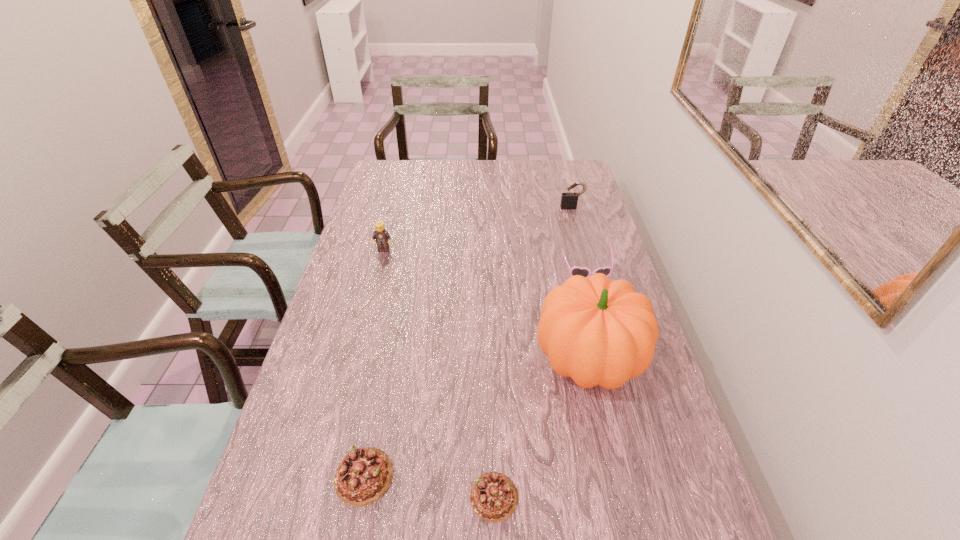
In order to click on vacant space at the far edge in this screenshot , I will do `click(421, 163)`.

This screenshot has height=540, width=960. In the image, there is a desktop. What are the coordinates of `vacant area at the left edge` in the screenshot? It's located at (339, 312).

In the image, there is a desktop. At what (x,y) coordinates should I click in order to perform the action: click on vacant region at the right edge. Please return your answer as a coordinate pair (x, y). Image resolution: width=960 pixels, height=540 pixels. Looking at the image, I should click on (613, 446).

The width and height of the screenshot is (960, 540). In the image, there is a desktop. Identify the location of vacant space at the far left corner. (408, 164).

This screenshot has width=960, height=540. Find the location of `vacant space at the near right corner of the desktop`. vacant space at the near right corner of the desktop is located at coordinates (706, 515).

Where is `free area in between the second farthest object and the shortest object`? The width and height of the screenshot is (960, 540). free area in between the second farthest object and the shortest object is located at coordinates (439, 373).

Where is `free space that is in between the third object from left to right and the pumpkin`? This screenshot has width=960, height=540. free space that is in between the third object from left to right and the pumpkin is located at coordinates (540, 428).

Where is `vacant region between the right chocolate cake and the padlock`? The width and height of the screenshot is (960, 540). vacant region between the right chocolate cake and the padlock is located at coordinates (533, 352).

Where is `free space between the padlock and the second farthest object`? Image resolution: width=960 pixels, height=540 pixels. free space between the padlock and the second farthest object is located at coordinates (478, 228).

I want to click on free space that is in between the Lego and the tallest object, so click(x=486, y=305).